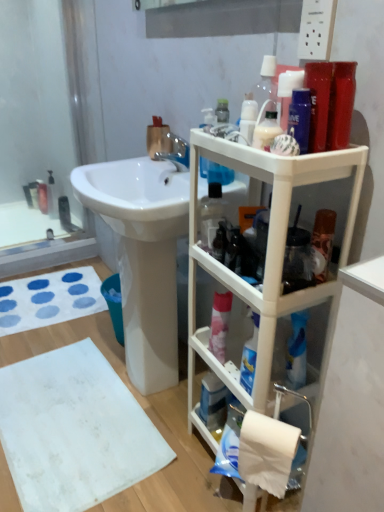
Measure the distance between point [114,462] and camera.

Point [114,462] and camera are 4.41 feet apart.

How much space does white fabric bath towel at lower left, the 1th bath towel viewed from the back, occupy horizontally?

white fabric bath towel at lower left, the 1th bath towel viewed from the back, is 20.08 inches wide.

This screenshot has width=384, height=512. In order to click on white fabric bath towel at lower left, the 2th bath towel in the bottom-to-top sequence in this screenshot , I will do `click(49, 298)`.

The width and height of the screenshot is (384, 512). What are the coordinates of `white plastic shelf at right` in the screenshot? It's located at point(265,257).

Considering the positions of objects chrome metallic faucet at upper center and white matte bath towel at lower left, the 1th bath towel from the bottom, in the image provided, who is in front, chrome metallic faucet at upper center or white matte bath towel at lower left, the 1th bath towel from the bottom,?

Positioned in front is white matte bath towel at lower left, the 1th bath towel from the bottom.

From a real-world perspective, is chrome metallic faucet at upper center physically located above or below white matte bath towel at lower left, marked as the 2th bath towel in a top-to-bottom arrangement?

chrome metallic faucet at upper center is situated higher than white matte bath towel at lower left, marked as the 2th bath towel in a top-to-bottom arrangement, in the real world.

Which is less distant, (180, 152) or (85, 437)?

Point (180, 152).

Can you confirm if chrome metallic faucet at upper center is taller than white matte bath towel at lower left, marked as the 2th bath towel in a top-to-bottom arrangement?

Yes, chrome metallic faucet at upper center is taller than white matte bath towel at lower left, marked as the 2th bath towel in a top-to-bottom arrangement.

From the image's perspective, relative to transparent glass door at upper left, is chrome metallic faucet at upper center above or below?

chrome metallic faucet at upper center is situated lower than transparent glass door at upper left in the image.

Considering the relative sizes of chrome metallic faucet at upper center and transparent glass door at upper left in the image provided, is chrome metallic faucet at upper center bigger than transparent glass door at upper left?

No.

Considering the positions of objects chrome metallic faucet at upper center and transparent glass door at upper left in the image provided, who is in front, chrome metallic faucet at upper center or transparent glass door at upper left?

chrome metallic faucet at upper center is closer to the camera.

From a real-world perspective, which object stands above the other?

In real-world perspective, chrome metallic faucet at upper center is above.

What's the angular difference between white plastic shelf at right and chrome metallic faucet at upper center's facing directions?

There is a 4.81-degree angle between the facing directions of white plastic shelf at right and chrome metallic faucet at upper center.

In the scene shown: Is white plastic shelf at right outside of chrome metallic faucet at upper center?

Yes, white plastic shelf at right is not within chrome metallic faucet at upper center.

Based on the photo, considering the relative sizes of white plastic shelf at right and chrome metallic faucet at upper center in the image provided, is white plastic shelf at right bigger than chrome metallic faucet at upper center?

Yes, white plastic shelf at right is bigger than chrome metallic faucet at upper center.

Does white plastic shelf at right turn towards chrome metallic faucet at upper center?

No, white plastic shelf at right is not oriented towards chrome metallic faucet at upper center.

Considering their positions, is chrome metallic faucet at upper center located in front of or behind gold metallic cup at upper center?

chrome metallic faucet at upper center is in front of gold metallic cup at upper center.

Is chrome metallic faucet at upper center located outside gold metallic cup at upper center?

Yes, chrome metallic faucet at upper center is outside of gold metallic cup at upper center.

This screenshot has width=384, height=512. Identify the location of tap that appears in front of the gold metallic cup at upper center. (174, 150).

Does chrome metallic faucet at upper center turn towards gold metallic cup at upper center?

No.

Considering the relative sizes of gold metallic cup at upper center and translucent plastic bottle at upper center in the image provided, is gold metallic cup at upper center bigger than translucent plastic bottle at upper center?

Yes, gold metallic cup at upper center is bigger than translucent plastic bottle at upper center.

Could you tell me if gold metallic cup at upper center is turned towards translucent plastic bottle at upper center?

No.

Can you tell me how much gold metallic cup at upper center and translucent plastic bottle at upper center differ in facing direction?

They differ by 3.75 degrees in their facing directions.

Does point (164, 132) come closer to viewer compared to point (267, 136)?

No, (164, 132) is behind (267, 136).

From a real-world perspective, does translucent plastic bottle at upper center sit lower than white matte toilet paper at lower right?

No, from a real-world perspective, translucent plastic bottle at upper center is not under white matte toilet paper at lower right.

Considering the sizes of translucent plastic bottle at upper center and white matte toilet paper at lower right in the image, is translucent plastic bottle at upper center taller or shorter than white matte toilet paper at lower right?

translucent plastic bottle at upper center is shorter than white matte toilet paper at lower right.

Visually, is translucent plastic bottle at upper center positioned to the left or to the right of white matte toilet paper at lower right?

translucent plastic bottle at upper center is to the left of white matte toilet paper at lower right.

Does translucent plastic bottle at upper center come behind white matte toilet paper at lower right?

Yes, the depth of translucent plastic bottle at upper center is greater than that of white matte toilet paper at lower right.

How different are the orientations of clear glass bottle at upper left and white matte bath towel at lower left, the 1th bath towel from the bottom, in degrees?

There is a 89-degree angle between the facing directions of clear glass bottle at upper left and white matte bath towel at lower left, the 1th bath towel from the bottom.

Between clear glass bottle at upper left and white matte bath towel at lower left, which appears as the second bath towel when viewed from the back, which one appears on the right side from the viewer's perspective?

white matte bath towel at lower left, which appears as the second bath towel when viewed from the back, is more to the right.

From the image's perspective, is clear glass bottle at upper left located above or below white matte bath towel at lower left, marked as the 2th bath towel in a top-to-bottom arrangement?

clear glass bottle at upper left is above white matte bath towel at lower left, marked as the 2th bath towel in a top-to-bottom arrangement.

Who is taller, clear glass bottle at upper left or white matte bath towel at lower left, the first bath towel in the front-to-back sequence?

Standing taller between the two is clear glass bottle at upper left.

Where is `the 1st bath towel to the left when counting from the chrome metallic faucet at upper center`? The width and height of the screenshot is (384, 512). the 1st bath towel to the left when counting from the chrome metallic faucet at upper center is located at coordinates (74, 430).

At what (x,y) coordinates should I click in order to perform the action: click on tap above the transparent glass door at upper left (from a real-world perspective). Please return your answer as a coordinate pair (x, y). The width and height of the screenshot is (384, 512). Looking at the image, I should click on (174, 150).

Which object lies nearer to the anchor point white matte bath towel at lower left, marked as the 2th bath towel in a top-to-bottom arrangement, gold metallic cup at upper center or transparent glass door at upper left?

gold metallic cup at upper center lies closer to white matte bath towel at lower left, marked as the 2th bath towel in a top-to-bottom arrangement, than the other object.

Looking at the image, which one is located closer to white glossy sink at center, chrome metallic faucet at upper center or white fabric bath towel at lower left, which is the first bath towel from top to bottom?

chrome metallic faucet at upper center is closer to white glossy sink at center.

Estimate the real-world distances between objects in this image. Which object is further from white matte bath towel at lower left, which appears as the second bath towel when viewed from the back, white glossy sink at center or gold metallic cup at upper center?

gold metallic cup at upper center is positioned further to the anchor white matte bath towel at lower left, which appears as the second bath towel when viewed from the back.

Consider the image. Looking at the image, which one is located further to transparent glass door at upper left, clear glass bottle at upper left or gold metallic cup at upper center?

gold metallic cup at upper center is positioned further to the anchor transparent glass door at upper left.

When comparing their distances from white plastic shelf at right, does chrome metallic faucet at upper center or white matte toilet paper at lower right seem further?

chrome metallic faucet at upper center lies further to white plastic shelf at right than the other object.

From the image, which object appears to be nearer to translucent plastic bottle at upper center, white plastic shelf at right or chrome metallic faucet at upper center?

Based on the image, white plastic shelf at right appears to be nearer to translucent plastic bottle at upper center.

From the image, which object appears to be farther from gold metallic cup at upper center, white matte toilet paper at lower right or white glossy sink at center?

white matte toilet paper at lower right lies further to gold metallic cup at upper center than the other object.

Which object lies nearer to the anchor point clear glass bottle at upper left, white glossy sink at center or translucent plastic bottle at upper center?

white glossy sink at center lies closer to clear glass bottle at upper left than the other object.

Identify the location of bottle that lies between chrome metallic faucet at upper center and white matte bath towel at lower left, which appears as the second bath towel when viewed from the back, from top to bottom. (266, 130).

The image size is (384, 512). What are the coordinates of `mouthwash located between white plastic shelf at right and white fabric bath towel at lower left, the 1th bath towel viewed from the back, in the depth direction` in the screenshot? It's located at (213, 402).

The height and width of the screenshot is (512, 384). In order to click on bath towel between gold metallic cup at upper center and blue plastic mouthwash at lower center in the vertical direction in this screenshot , I will do `click(49, 298)`.

At what (x,y) coordinates should I click in order to perform the action: click on sink between white matte toilet paper at lower right and clear glass bottle at upper left in the front-back direction. Please return your answer as a coordinate pair (x, y). This screenshot has width=384, height=512. Looking at the image, I should click on (143, 256).